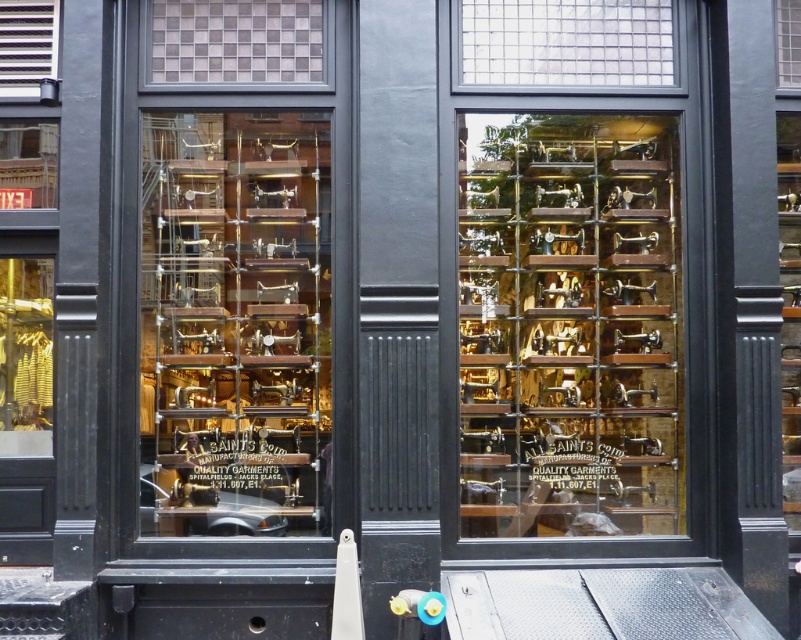
Looking at this image, you are standing in front of the shop and see two points marked on the window. The first point is at coordinate point (329, 284) and the second is at point (14, 179). Which point is closer to you?

Point (14, 179) is closer to you because it is in front of point (329, 284).

Consider the image. You are a window cleaner who needs to clean the clear glass grid at upper center and the clear glass window at upper right. Which one should you clean first if you want to start from the top?

You should clean the clear glass window at upper right first because it is positioned above the clear glass grid at upper center.

You are a window cleaner who needs to clean the clear glass grid at upper center and the clear glass window at upper right. Which one requires a wider cleaning tool?

The clear glass grid at upper center requires a wider cleaning tool because it might be wider than the clear glass window at upper right.